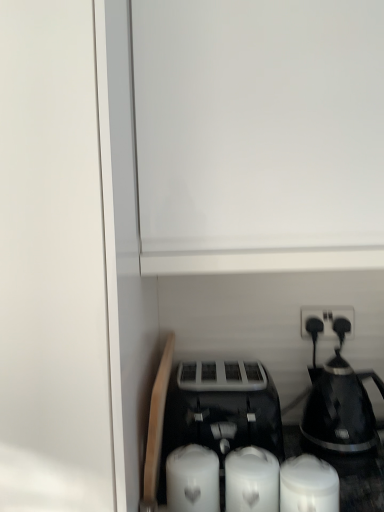
This screenshot has width=384, height=512. What are the coordinates of `black glossy coffee maker at right` in the screenshot? It's located at [x=338, y=404].

What do you see at coordinates (338, 404) in the screenshot? I see `black glossy coffee maker at right` at bounding box center [338, 404].

This screenshot has width=384, height=512. What do you see at coordinates (251, 480) in the screenshot?
I see `white matte candle at center, the second candle from the left` at bounding box center [251, 480].

Image resolution: width=384 pixels, height=512 pixels. Describe the element at coordinates (192, 480) in the screenshot. I see `white matte candle at lower center, placed as the third candle when sorted from right to left` at that location.

I want to click on black plastic toaster at center, so click(x=224, y=411).

The image size is (384, 512). What do you see at coordinates (327, 320) in the screenshot?
I see `black plastic electric outlet at upper right` at bounding box center [327, 320].

Where is `black plastic electric outlet at upper right`? The width and height of the screenshot is (384, 512). black plastic electric outlet at upper right is located at coordinates (327, 320).

At what (x,y) coordinates should I click in order to perform the action: click on black glossy coffee maker at right. Please return your answer as a coordinate pair (x, y). The width and height of the screenshot is (384, 512). Looking at the image, I should click on (338, 404).

How much distance is there between black plastic electric outlet at upper right and black glossy coffee maker at right?

The distance of black plastic electric outlet at upper right from black glossy coffee maker at right is 6.89 inches.

Which object is more forward, black plastic electric outlet at upper right or black glossy coffee maker at right?

black glossy coffee maker at right is in front.

Between black plastic electric outlet at upper right and black glossy coffee maker at right, which one appears on the left side from the viewer's perspective?

black plastic electric outlet at upper right is more to the left.

Is point (352, 325) less distant than point (322, 393)?

That is False.

Which of these two, white matte candle at lower right, marked as the 1th candle in a right-to-left arrangement, or black glossy coffee maker at right, is smaller?

white matte candle at lower right, marked as the 1th candle in a right-to-left arrangement, is smaller.

Considering the points (286, 462) and (318, 442), which point is behind, point (286, 462) or point (318, 442)?

Point (318, 442)

Can you see white matte candle at lower right, marked as the 1th candle in a right-to-left arrangement, touching black glossy coffee maker at right?

No, white matte candle at lower right, marked as the 1th candle in a right-to-left arrangement, is not in contact with black glossy coffee maker at right.

Based on the photo, considering their positions, is black glossy coffee maker at right located in front of or behind white matte candle at lower center, placed as the third candle when sorted from right to left?

black glossy coffee maker at right is behind white matte candle at lower center, placed as the third candle when sorted from right to left.

Which point is more forward, (341, 424) or (193, 448)?

The point (193, 448) is in front.

Looking at the image, does black glossy coffee maker at right seem bigger or smaller compared to white matte candle at lower center, placed as the third candle when sorted from right to left?

Considering their sizes, black glossy coffee maker at right takes up more space than white matte candle at lower center, placed as the third candle when sorted from right to left.

How many degrees apart are the facing directions of black glossy coffee maker at right and white matte candle at lower center, placed as the third candle when sorted from right to left?

0.00237 degrees separate the facing orientations of black glossy coffee maker at right and white matte candle at lower center, placed as the third candle when sorted from right to left.

Does black plastic toaster at center have a greater width compared to white matte candle at lower center, placed as the third candle when sorted from right to left?

Indeed, black plastic toaster at center has a greater width compared to white matte candle at lower center, placed as the third candle when sorted from right to left.

Considering the positions of objects black plastic toaster at center and white matte candle at lower center, placed as the third candle when sorted from right to left, in the image provided, who is behind, black plastic toaster at center or white matte candle at lower center, placed as the third candle when sorted from right to left,?

Positioned behind is black plastic toaster at center.

Is black plastic toaster at center bigger than white matte candle at lower center, which is the 1th candle from left to right?

Indeed, black plastic toaster at center has a larger size compared to white matte candle at lower center, which is the 1th candle from left to right.

Is black plastic toaster at center with white matte candle at lower center, which is the 1th candle from left to right?

No, black plastic toaster at center is not next to white matte candle at lower center, which is the 1th candle from left to right.

Consider the image. Considering the relative positions of black plastic toaster at center and white matte candle at center, which is the second candle from right to left, in the image provided, is black plastic toaster at center behind white matte candle at center, which is the second candle from right to left,?

Yes, black plastic toaster at center is behind white matte candle at center, which is the second candle from right to left.

Is black plastic toaster at center oriented towards white matte candle at center, the second candle from the left?

Yes, black plastic toaster at center faces towards white matte candle at center, the second candle from the left.

Is black plastic toaster at center positioned far away from white matte candle at center, which is the second candle from right to left?

They are positioned close to each other.

From the image's perspective, is black plastic toaster at center positioned above or below white matte candle at center, the second candle from the left?

Based on their image positions, black plastic toaster at center is located above white matte candle at center, the second candle from the left.

Which object is thinner, white matte candle at lower right, which ranks as the third candle in left-to-right order, or white matte candle at center, the second candle from the left?

Thinner between the two is white matte candle at center, the second candle from the left.

From a real-world perspective, is white matte candle at lower right, which ranks as the third candle in left-to-right order, physically located above or below white matte candle at center, the second candle from the left?

white matte candle at lower right, which ranks as the third candle in left-to-right order, is situated lower than white matte candle at center, the second candle from the left, in the real world.

Which object is closer to the camera taking this photo, white matte candle at lower right, which ranks as the third candle in left-to-right order, or white matte candle at center, which is the second candle from right to left?

white matte candle at lower right, which ranks as the third candle in left-to-right order.

From the image's perspective, is white matte candle at lower right, which ranks as the third candle in left-to-right order, above or below white matte candle at center, which is the second candle from right to left?

Clearly, from the image's perspective, white matte candle at lower right, which ranks as the third candle in left-to-right order, is above white matte candle at center, which is the second candle from right to left.

Considering the positions of objects white matte candle at lower right, which ranks as the third candle in left-to-right order, and black plastic toaster at center in the image provided, who is in front, white matte candle at lower right, which ranks as the third candle in left-to-right order, or black plastic toaster at center?

white matte candle at lower right, which ranks as the third candle in left-to-right order, is more forward.

From a real-world perspective, who is located lower, white matte candle at lower right, which ranks as the third candle in left-to-right order, or black plastic toaster at center?

white matte candle at lower right, which ranks as the third candle in left-to-right order, is physically lower.

Can you confirm if white matte candle at lower right, which ranks as the third candle in left-to-right order, is wider than black plastic toaster at center?

No, white matte candle at lower right, which ranks as the third candle in left-to-right order, is not wider than black plastic toaster at center.

How distant is white matte candle at lower right, marked as the 1th candle in a right-to-left arrangement, from black plastic toaster at center?

white matte candle at lower right, marked as the 1th candle in a right-to-left arrangement, is 12.01 inches away from black plastic toaster at center.

Find the location of a particular element. The width and height of the screenshot is (384, 512). coffee maker in front of the black plastic electric outlet at upper right is located at coordinates (338, 404).

The height and width of the screenshot is (512, 384). Find the location of `coffee maker behind the white matte candle at lower right, marked as the 1th candle in a right-to-left arrangement`. coffee maker behind the white matte candle at lower right, marked as the 1th candle in a right-to-left arrangement is located at coordinates (338, 404).

When comparing their distances from black plastic toaster at center, does white matte candle at lower right, marked as the 1th candle in a right-to-left arrangement, or white matte candle at lower center, placed as the third candle when sorted from right to left, seem further?

The object further to black plastic toaster at center is white matte candle at lower right, marked as the 1th candle in a right-to-left arrangement.

Which object lies nearer to the anchor point black plastic toaster at center, black plastic electric outlet at upper right or white matte candle at lower center, which is the 1th candle from left to right?

Based on the image, white matte candle at lower center, which is the 1th candle from left to right, appears to be nearer to black plastic toaster at center.

From the picture: Estimate the real-world distances between objects in this image. Which object is closer to white matte candle at center, which is the second candle from right to left, black plastic toaster at center or black glossy coffee maker at right?

black plastic toaster at center.

From the image, which object appears to be farther from white matte candle at lower right, which ranks as the third candle in left-to-right order, white matte candle at center, the second candle from the left, or black plastic toaster at center?

black plastic toaster at center is positioned further to the anchor white matte candle at lower right, which ranks as the third candle in left-to-right order.

Which object lies nearer to the anchor point black glossy coffee maker at right, white matte candle at lower center, which is the 1th candle from left to right, or white matte candle at lower right, marked as the 1th candle in a right-to-left arrangement?

The object closer to black glossy coffee maker at right is white matte candle at lower right, marked as the 1th candle in a right-to-left arrangement.

When comparing their distances from black glossy coffee maker at right, does black plastic toaster at center or white matte candle at center, which is the second candle from right to left, seem closer?

black plastic toaster at center is positioned closer to the anchor black glossy coffee maker at right.

From the image, which object appears to be farther from black plastic electric outlet at upper right, black glossy coffee maker at right or white matte candle at center, which is the second candle from right to left?

white matte candle at center, which is the second candle from right to left.

When comparing their distances from black plastic toaster at center, does white matte candle at center, the second candle from the left, or white matte candle at lower center, which is the 1th candle from left to right, seem further?

white matte candle at lower center, which is the 1th candle from left to right, lies further to black plastic toaster at center than the other object.

What are the coordinates of `toaster between white matte candle at center, the second candle from the left, and black plastic electric outlet at upper right, along the z-axis` in the screenshot? It's located at (224, 411).

Locate an element on the screen. The width and height of the screenshot is (384, 512). candle located between white matte candle at center, the second candle from the left, and black plastic electric outlet at upper right in the depth direction is located at coordinates (192, 480).

Where is `candle between white matte candle at center, the second candle from the left, and black plastic toaster at center in the front-back direction`? candle between white matte candle at center, the second candle from the left, and black plastic toaster at center in the front-back direction is located at coordinates (192, 480).

Where is `candle situated between white matte candle at center, which is the second candle from right to left, and black glossy coffee maker at right from left to right`? Image resolution: width=384 pixels, height=512 pixels. candle situated between white matte candle at center, which is the second candle from right to left, and black glossy coffee maker at right from left to right is located at coordinates (308, 485).